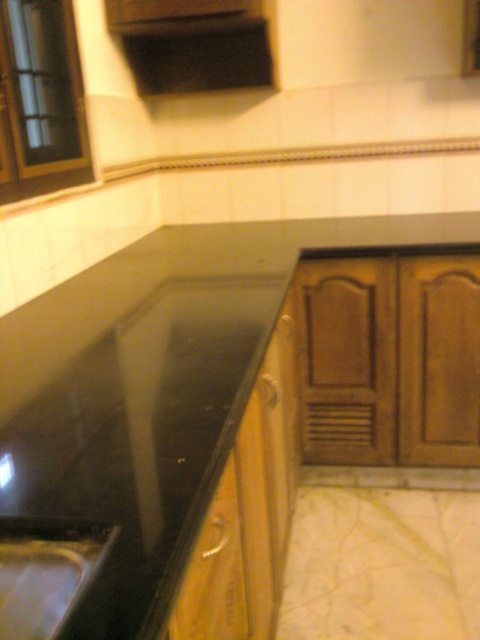
You are organizing a kitchen and need to place a 1.2 meter wide cutting board on the black granite countertop at center and the wooden drawer at lower center. Which surface can accommodate the cutting board based on their widths?

The black granite countertop at center has a greater width than the wooden drawer at lower center, so the cutting board can be placed on the black granite countertop at center.

Looking at this image, you are standing in the kitchen and want to place a cutting board on the black granite countertop at center. Based on its position, can you estimate where on the countertop you should place it?

The black granite countertop at center is located at coordinates approximately 0.436 on the x axis and 0.377 on the y axis, so you should place the cutting board near that central position.